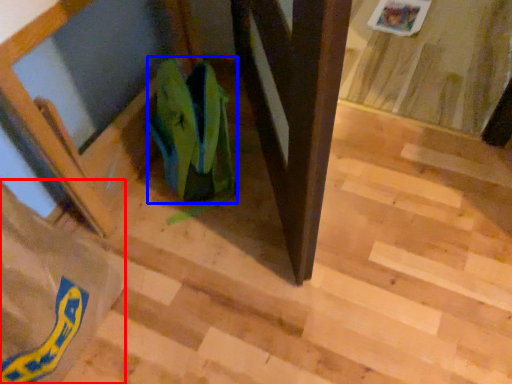
Question: Among these objects, which one is nearest to the camera, grocery bag (highlighted by a red box) or grocery bag (highlighted by a blue box)?

Choices:
 (A) grocery bag
 (B) grocery bag

Answer: (A)